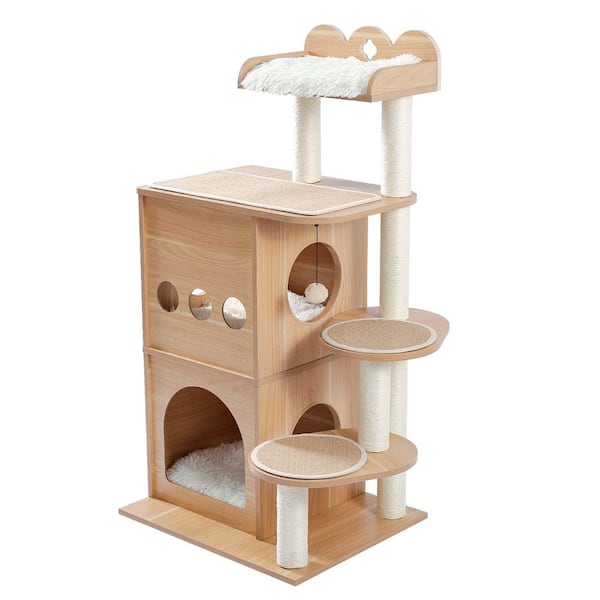
I want to click on fuzzy cushion, so click(x=210, y=469), click(x=300, y=310), click(x=322, y=67).